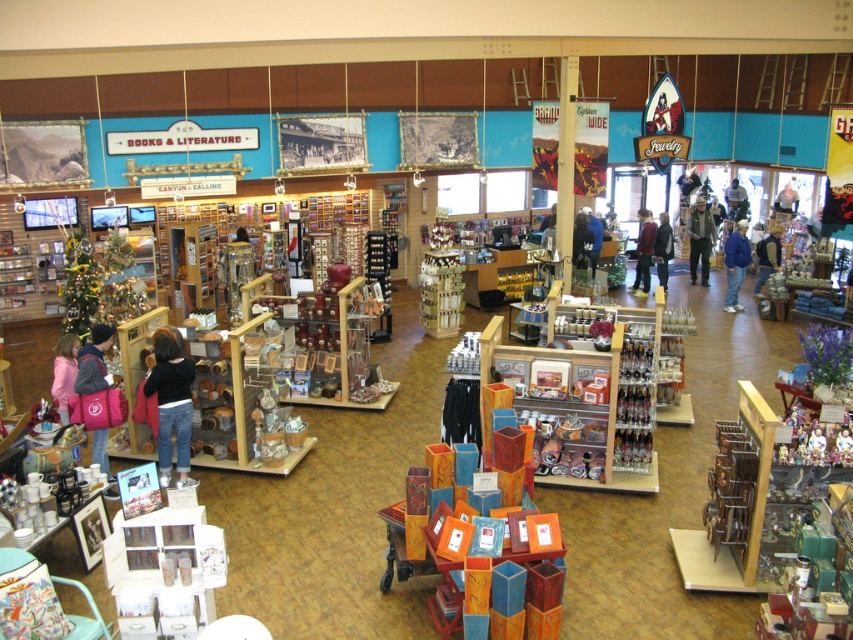
In the scene shown: You are a customer in the store and see the khaki uniform pants at center and the red plaid shirt at center. Which item is located higher up on the display?

The khaki uniform pants at center is above the red plaid shirt at center, so it is located higher up on the display.